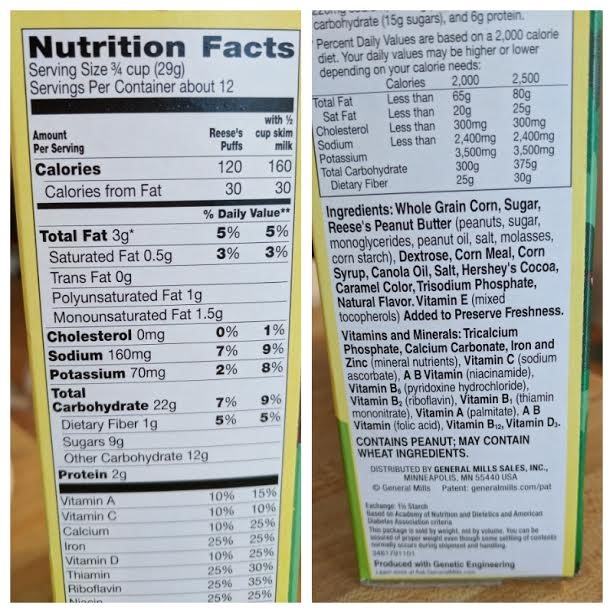
This screenshot has width=613, height=613. Find the location of `wooden table`. wooden table is located at coordinates (328, 543).